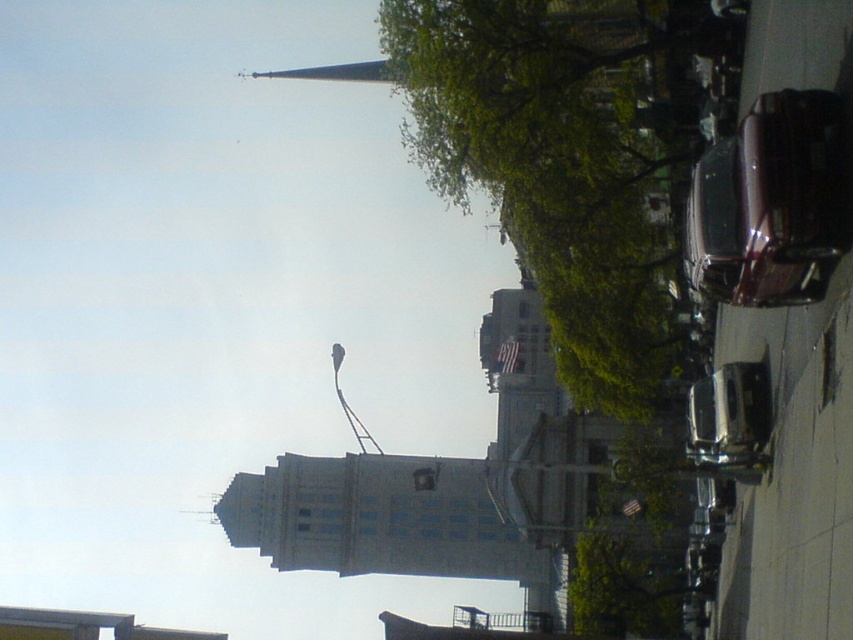
You are standing at the center of the image and see a point marked at coordinates point (x=770, y=204). Based on the scene description, can you identify which object this point belongs to?

The point (x=770, y=204) is on the shiny maroon car at right.

You are a delivery person who needs to park your 5.5 meter long truck between the green leafy tree at upper center and the shiny silver sedan at center. Can you fit your truck in the space between them without overlapping either vehicle?

The distance between the green leafy tree at upper center and the shiny silver sedan at center is 19.55 meters. Since your truck is 5.5 meters long, there is sufficient space to park between them without overlapping either vehicle.

You are standing in the urban scene and want to take a photo of the green leafy tree at upper center. Based on its position, where should you aim your camera?

The green leafy tree at upper center is located at point 0.252 on the x axis and 0.665 on the y axis, so you should aim your camera towards the upper center area of the scene to capture it.